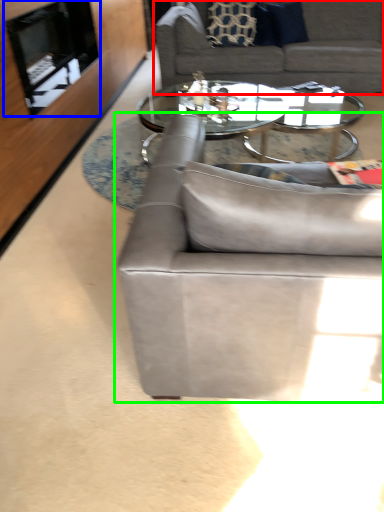
Question: Considering the real-world distances, which object is farthest from studio couch (highlighted by a red box)? fireplace (highlighted by a blue box) or studio couch (highlighted by a green box)?

Choices:
 (A) fireplace
 (B) studio couch

Answer: (B)